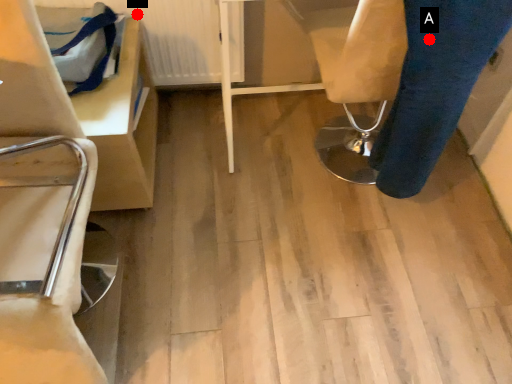
Question: Two points are circled on the image, labeled by A and B beside each circle. Which point is farther to the camera?

Choices:
 (A) A is further
 (B) B is further

Answer: (B)